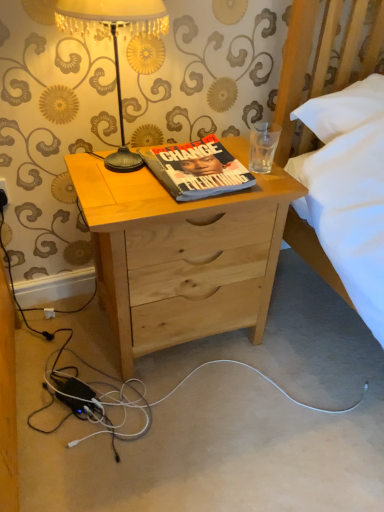
Question: Is natural wood nightstand at center not within gold textured lampshade at upper left?

Choices:
 (A) no
 (B) yes

Answer: (B)

Question: From a real-world perspective, is natural wood nightstand at center beneath gold textured lampshade at upper left?

Choices:
 (A) yes
 (B) no

Answer: (A)

Question: Can you confirm if natural wood nightstand at center is shorter than gold textured lampshade at upper left?

Choices:
 (A) yes
 (B) no

Answer: (B)

Question: Is natural wood nightstand at center oriented away from gold textured lampshade at upper left?

Choices:
 (A) no
 (B) yes

Answer: (A)

Question: Does natural wood nightstand at center have a larger size compared to gold textured lampshade at upper left?

Choices:
 (A) no
 (B) yes

Answer: (B)

Question: Considering the relative sizes of natural wood nightstand at center and gold textured lampshade at upper left in the image provided, is natural wood nightstand at center wider than gold textured lampshade at upper left?

Choices:
 (A) no
 (B) yes

Answer: (B)

Question: Is natural wood nightstand at center beside hardcover book at center?

Choices:
 (A) yes
 (B) no

Answer: (B)

Question: Considering the relative sizes of natural wood nightstand at center and hardcover book at center in the image provided, is natural wood nightstand at center wider than hardcover book at center?

Choices:
 (A) no
 (B) yes

Answer: (B)

Question: Is hardcover book at center located within natural wood nightstand at center?

Choices:
 (A) yes
 (B) no

Answer: (B)

Question: Would you say natural wood nightstand at center is outside hardcover book at center?

Choices:
 (A) no
 (B) yes

Answer: (B)

Question: Is natural wood nightstand at center shorter than hardcover book at center?

Choices:
 (A) yes
 (B) no

Answer: (B)

Question: Is natural wood nightstand at center bigger than hardcover book at center?

Choices:
 (A) yes
 (B) no

Answer: (A)

Question: Does gold textured lampshade at upper left have a lesser height compared to natural wood nightstand at center?

Choices:
 (A) yes
 (B) no

Answer: (A)